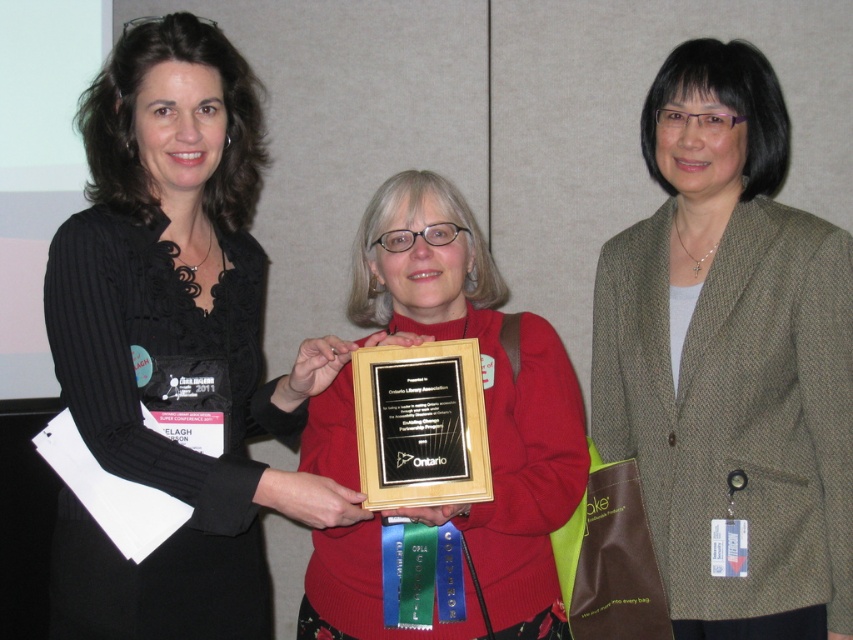
Image resolution: width=853 pixels, height=640 pixels. What do you see at coordinates (175, 342) in the screenshot? I see `black ribbed sweater at upper left` at bounding box center [175, 342].

Which is below, black ribbed sweater at upper left or wooden plaque at center?

Positioned lower is wooden plaque at center.

Which is in front, point (221, 547) or point (386, 349)?

Point (386, 349) is in front.

Locate an element on the screen. black ribbed sweater at upper left is located at coordinates (175, 342).

Is green tweed blazer at center to the left of wooden plaque at center from the viewer's perspective?

No, green tweed blazer at center is not to the left of wooden plaque at center.

Locate an element on the screen. This screenshot has height=640, width=853. green tweed blazer at center is located at coordinates (730, 360).

Find the location of `green tweed blazer at center`. green tweed blazer at center is located at coordinates (730, 360).

The width and height of the screenshot is (853, 640). Identify the location of green tweed blazer at center. (730, 360).

Which of these two, matte wood plaque at center or wooden plaque at center, stands shorter?

wooden plaque at center is shorter.

Does matte wood plaque at center come in front of wooden plaque at center?

No, matte wood plaque at center is further to the viewer.

Between point (364, 342) and point (387, 458), which one is positioned in front?

Point (387, 458) is in front.

Locate an element on the screen. matte wood plaque at center is located at coordinates (482, 388).